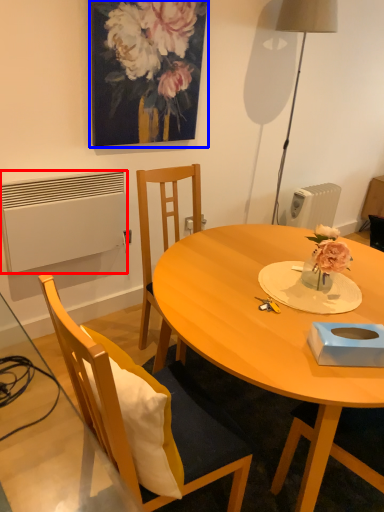
Question: Among these objects, which one is farthest to the camera, radiator (highlighted by a red box) or picture frame (highlighted by a blue box)?

Choices:
 (A) radiator
 (B) picture frame

Answer: (A)